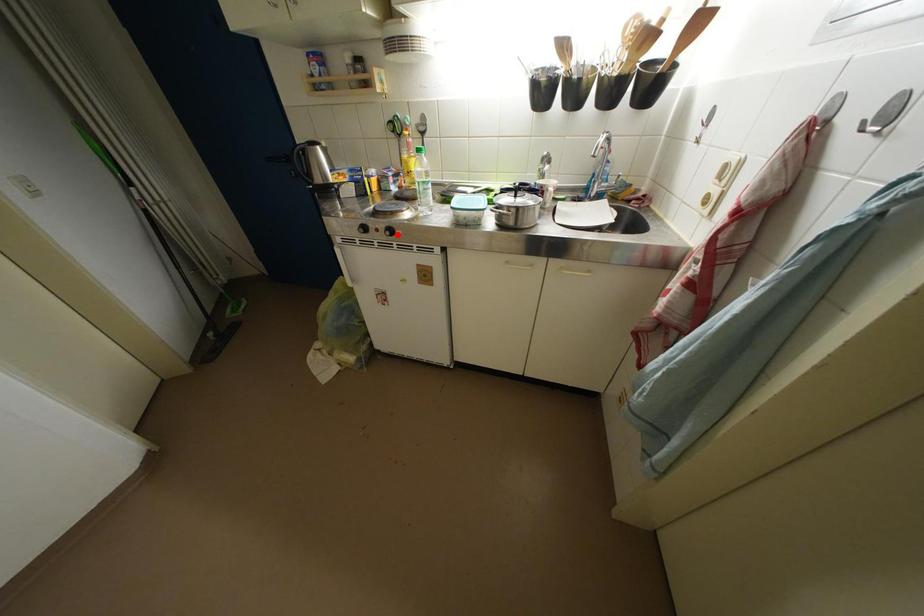
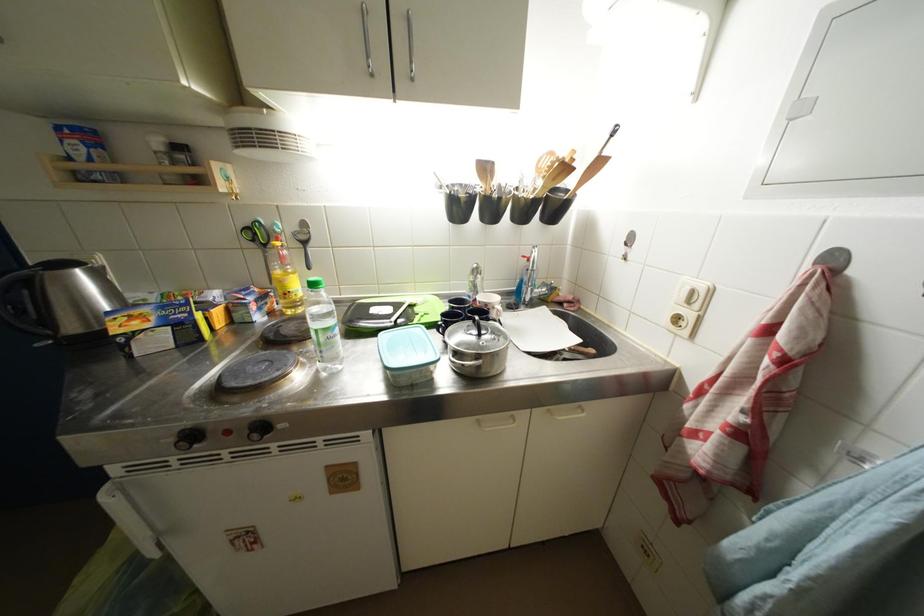
Find the pixel in the second image that matches the highlighted location in the first image.

(269, 431)